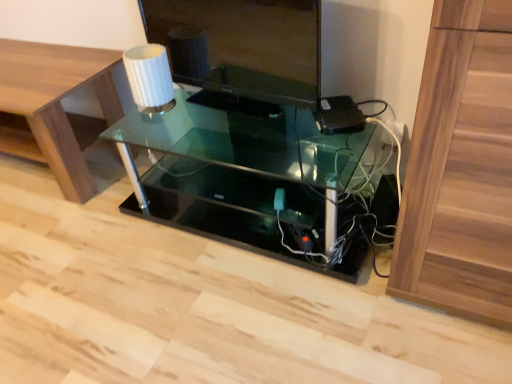
Question: Does matte black monitor at center lie in front of white ribbed glass at upper center?

Choices:
 (A) no
 (B) yes

Answer: (B)

Question: Could you tell me if matte black monitor at center is turned towards white ribbed glass at upper center?

Choices:
 (A) yes
 (B) no

Answer: (A)

Question: Considering the relative sizes of matte black monitor at center and white ribbed glass at upper center in the image provided, is matte black monitor at center taller than white ribbed glass at upper center?

Choices:
 (A) yes
 (B) no

Answer: (A)

Question: Can you confirm if matte black monitor at center is positioned to the left of white ribbed glass at upper center?

Choices:
 (A) no
 (B) yes

Answer: (A)

Question: Is matte black monitor at center to the right of white ribbed glass at upper center from the viewer's perspective?

Choices:
 (A) no
 (B) yes

Answer: (B)

Question: From the image's perspective, is matte black monitor at center located beneath white ribbed glass at upper center?

Choices:
 (A) no
 (B) yes

Answer: (A)

Question: Does wooden table at lower left have a smaller size compared to matte black monitor at center?

Choices:
 (A) yes
 (B) no

Answer: (B)

Question: Is wooden table at lower left looking in the opposite direction of matte black monitor at center?

Choices:
 (A) no
 (B) yes

Answer: (A)

Question: Is matte black monitor at center surrounded by wooden table at lower left?

Choices:
 (A) yes
 (B) no

Answer: (B)

Question: From the image's perspective, is wooden table at lower left under matte black monitor at center?

Choices:
 (A) no
 (B) yes

Answer: (B)

Question: From a real-world perspective, does wooden table at lower left sit lower than matte black monitor at center?

Choices:
 (A) yes
 (B) no

Answer: (A)

Question: Does wooden table at lower left turn towards matte black monitor at center?

Choices:
 (A) no
 (B) yes

Answer: (A)

Question: Does white ribbed glass at upper center have a greater height compared to matte black monitor at center?

Choices:
 (A) no
 (B) yes

Answer: (A)